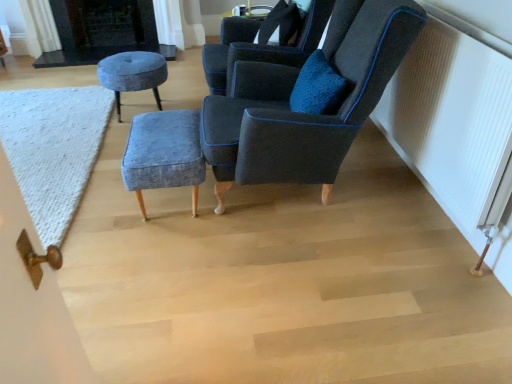
Question: Does white textured radiator at right have a lesser height compared to velvet dark blue chair at upper right, which appears as the second chair when viewed from the back?

Choices:
 (A) yes
 (B) no

Answer: (A)

Question: Is velvet dark blue chair at upper right, which appears as the second chair when viewed from the back, at the back of white textured radiator at right?

Choices:
 (A) no
 (B) yes

Answer: (B)

Question: Does white textured radiator at right have a greater width compared to velvet dark blue chair at upper right, which is counted as the first chair, starting from the front?

Choices:
 (A) yes
 (B) no

Answer: (B)

Question: Is velvet dark blue chair at upper right, which is counted as the first chair, starting from the front, located within white textured radiator at right?

Choices:
 (A) no
 (B) yes

Answer: (A)

Question: Is white textured radiator at right taller than velvet dark blue chair at upper right, which is counted as the first chair, starting from the front?

Choices:
 (A) no
 (B) yes

Answer: (A)

Question: In terms of height, does denim fabric stool at center, the 2th stool when ordered from back to front, look taller or shorter compared to dark gray stone fireplace at upper left?

Choices:
 (A) short
 (B) tall

Answer: (A)

Question: From the image's perspective, is denim fabric stool at center, arranged as the second stool when viewed from the top, positioned above or below dark gray stone fireplace at upper left?

Choices:
 (A) below
 (B) above

Answer: (A)

Question: In terms of width, does denim fabric stool at center, the 2th stool when ordered from back to front, look wider or thinner when compared to dark gray stone fireplace at upper left?

Choices:
 (A) wide
 (B) thin

Answer: (A)

Question: From a real-world perspective, is denim fabric stool at center, arranged as the second stool when viewed from the top, above or below dark gray stone fireplace at upper left?

Choices:
 (A) above
 (B) below

Answer: (B)

Question: Would you say white knitted mat at lower left is to the left or to the right of velvet dark blue chair at upper right, which is counted as the first chair, starting from the front, in the picture?

Choices:
 (A) right
 (B) left

Answer: (B)

Question: Do you think white knitted mat at lower left is within velvet dark blue chair at upper right, which appears as the second chair when viewed from the back, or outside of it?

Choices:
 (A) inside
 (B) outside

Answer: (B)

Question: Considering their positions, is white knitted mat at lower left located in front of or behind velvet dark blue chair at upper right, which appears as the second chair when viewed from the back?

Choices:
 (A) behind
 (B) front

Answer: (A)

Question: Considering the positions of point (73, 196) and point (355, 94), is point (73, 196) closer or farther from the camera than point (355, 94)?

Choices:
 (A) farther
 (B) closer

Answer: (A)

Question: From a real-world perspective, is dark gray stone fireplace at upper left physically located above or below denim fabric stool at center, which ranks as the 1th stool in front-to-back order?

Choices:
 (A) below
 (B) above

Answer: (B)

Question: Looking at their shapes, would you say dark gray stone fireplace at upper left is wider or thinner than denim fabric stool at center, the 2th stool when ordered from back to front?

Choices:
 (A) wide
 (B) thin

Answer: (B)